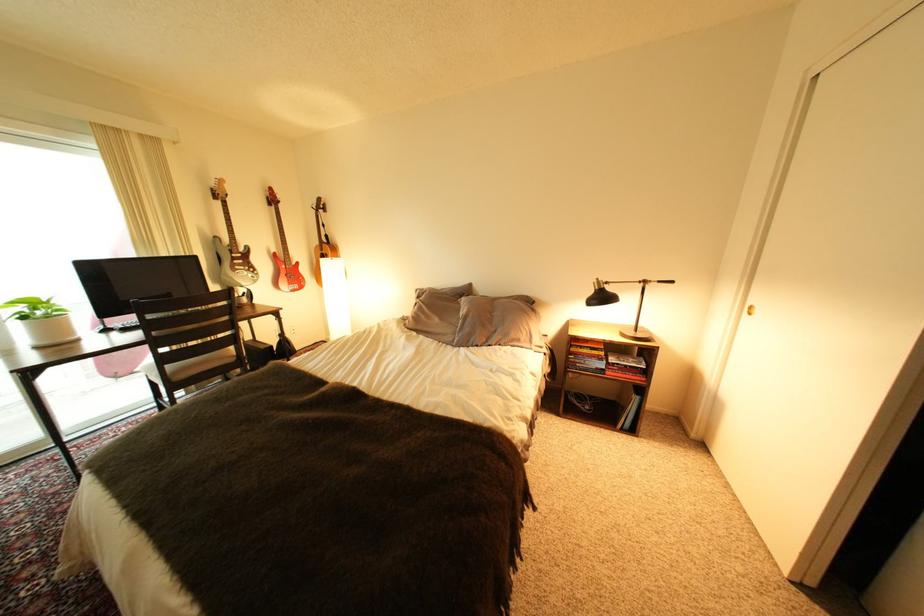
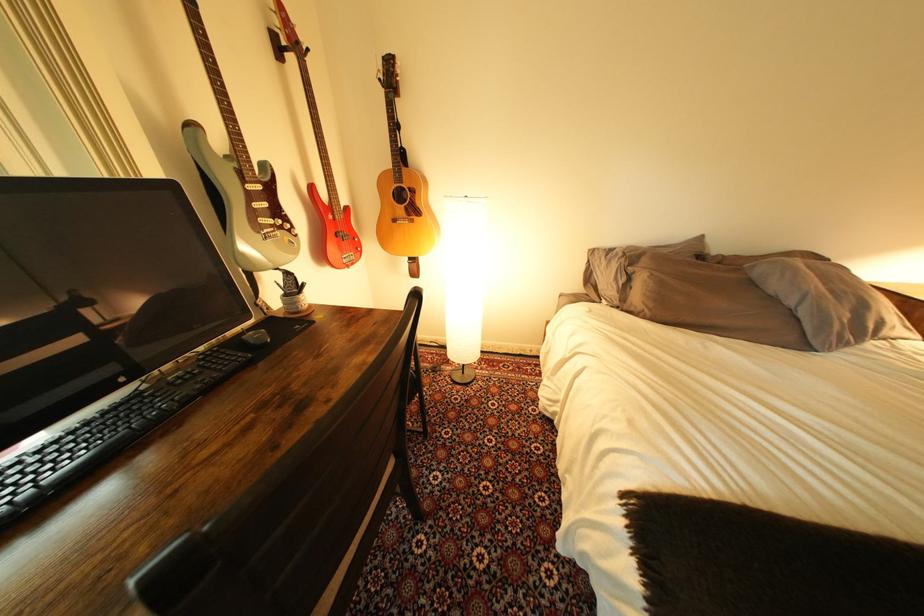
The point at (x=432, y=330) is marked in the first image. Where is the corresponding point in the second image?

(701, 322)